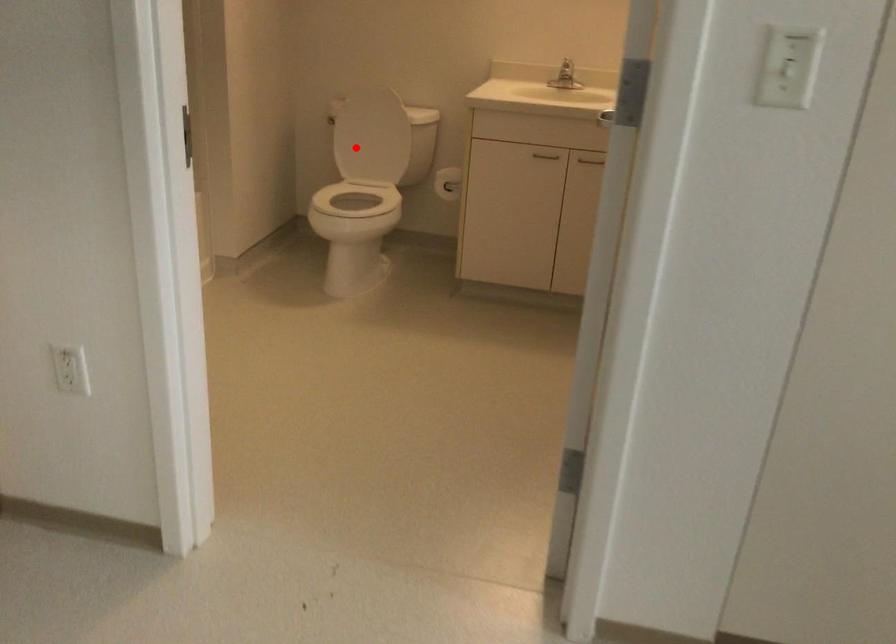
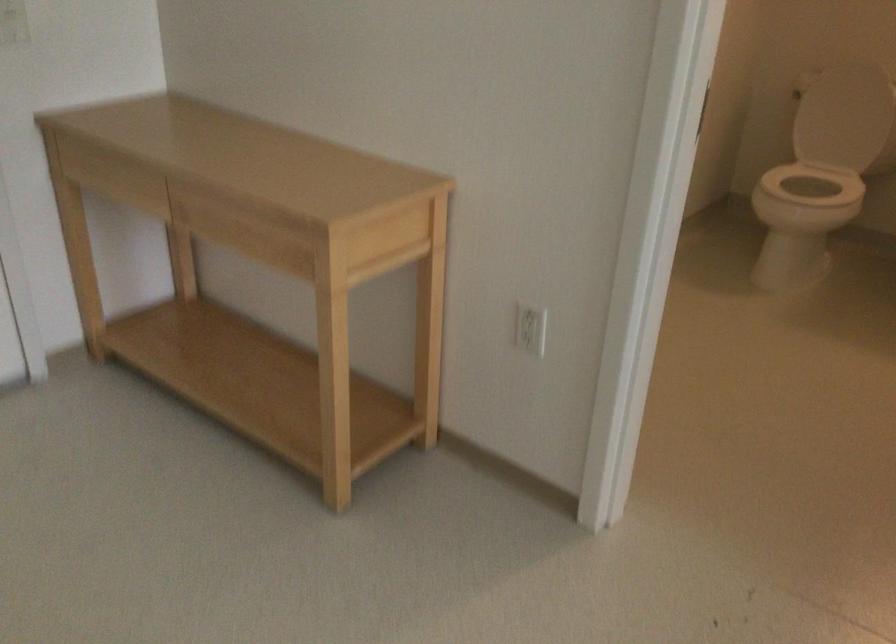
In the second image, find the point that corresponds to the highlighted location in the first image.

(839, 118)